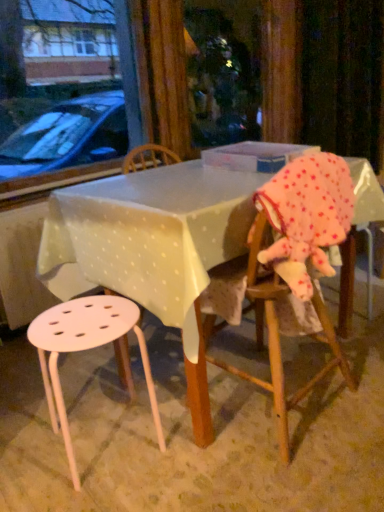
I want to click on free space that is in between wooden chair at right and white plastic table at center, so click(343, 386).